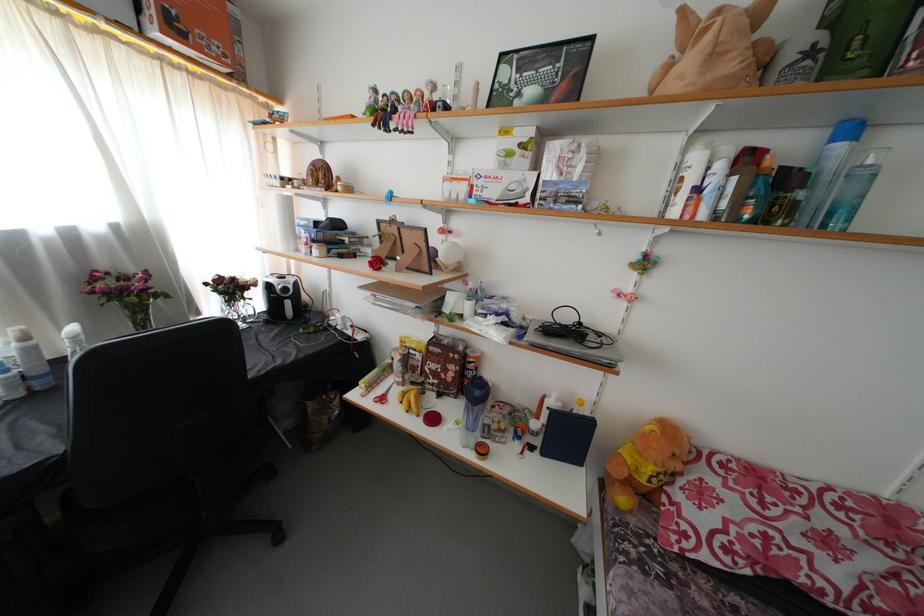
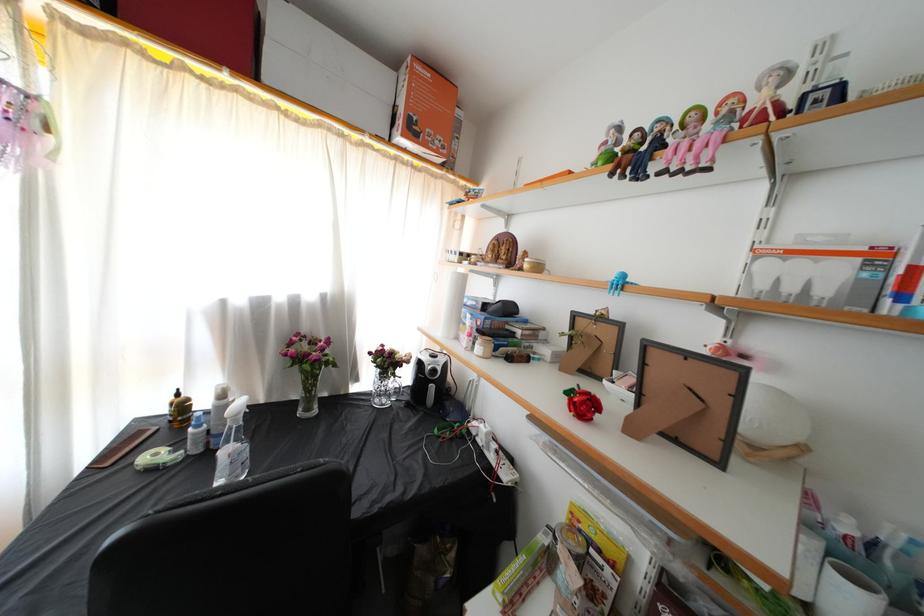
The point at (140, 330) is marked in the first image. Where is the corresponding point in the second image?

(310, 392)